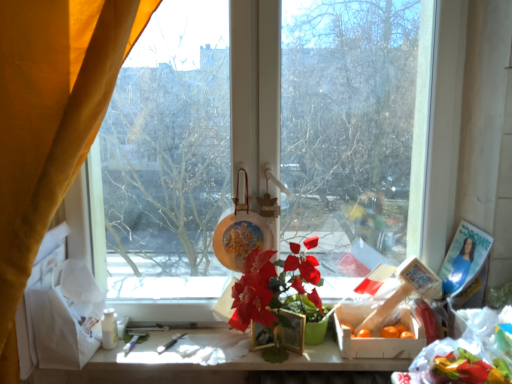
Question: Considering the relative sizes of transparent glass window at center and velvet yellow curtain at left in the image provided, is transparent glass window at center bigger than velvet yellow curtain at left?

Choices:
 (A) yes
 (B) no

Answer: (B)

Question: From a real-world perspective, does transparent glass window at center sit lower than velvet yellow curtain at left?

Choices:
 (A) yes
 (B) no

Answer: (B)

Question: Does transparent glass window at center have a greater height compared to velvet yellow curtain at left?

Choices:
 (A) yes
 (B) no

Answer: (B)

Question: Does transparent glass window at center contain velvet yellow curtain at left?

Choices:
 (A) yes
 (B) no

Answer: (B)

Question: Is transparent glass window at center facing towards velvet yellow curtain at left?

Choices:
 (A) yes
 (B) no

Answer: (A)

Question: Choose the correct answer: Is matte plastic flower at center inside velvet yellow curtain at left or outside it?

Choices:
 (A) outside
 (B) inside

Answer: (A)

Question: From a real-world perspective, relative to velvet yellow curtain at left, is matte plastic flower at center vertically above or below?

Choices:
 (A) above
 (B) below

Answer: (B)

Question: Considering the positions of point (286, 269) and point (83, 29), is point (286, 269) closer or farther from the camera than point (83, 29)?

Choices:
 (A) closer
 (B) farther

Answer: (B)

Question: Considering the relative positions of matte plastic flower at center and velvet yellow curtain at left in the image provided, is matte plastic flower at center to the left or to the right of velvet yellow curtain at left?

Choices:
 (A) left
 (B) right

Answer: (B)

Question: Is point (428, 178) positioned closer to the camera than point (204, 331)?

Choices:
 (A) farther
 (B) closer

Answer: (B)

Question: Relative to white matte table at center, is transparent glass window at center in front or behind?

Choices:
 (A) front
 (B) behind

Answer: (B)

Question: Do you think transparent glass window at center is within white matte table at center, or outside of it?

Choices:
 (A) inside
 (B) outside

Answer: (B)

Question: From the image's perspective, relative to white matte table at center, is transparent glass window at center above or below?

Choices:
 (A) below
 (B) above

Answer: (B)

Question: From the image's perspective, relative to matte plastic flower at center, is wooden crate of oranges at center above or below?

Choices:
 (A) below
 (B) above

Answer: (A)

Question: Which is correct: wooden crate of oranges at center is inside matte plastic flower at center, or outside of it?

Choices:
 (A) outside
 (B) inside

Answer: (A)